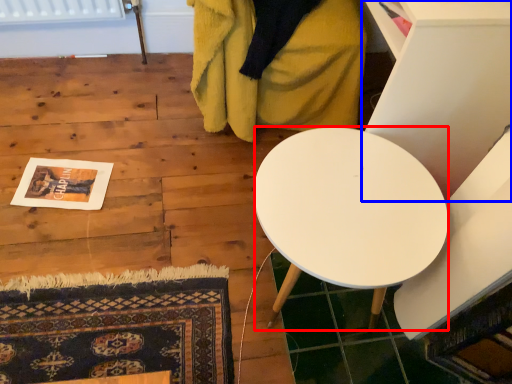
Question: Which of the following is the closest to the observer, desk (highlighted by a red box) or furniture (highlighted by a blue box)?

Choices:
 (A) desk
 (B) furniture

Answer: (A)